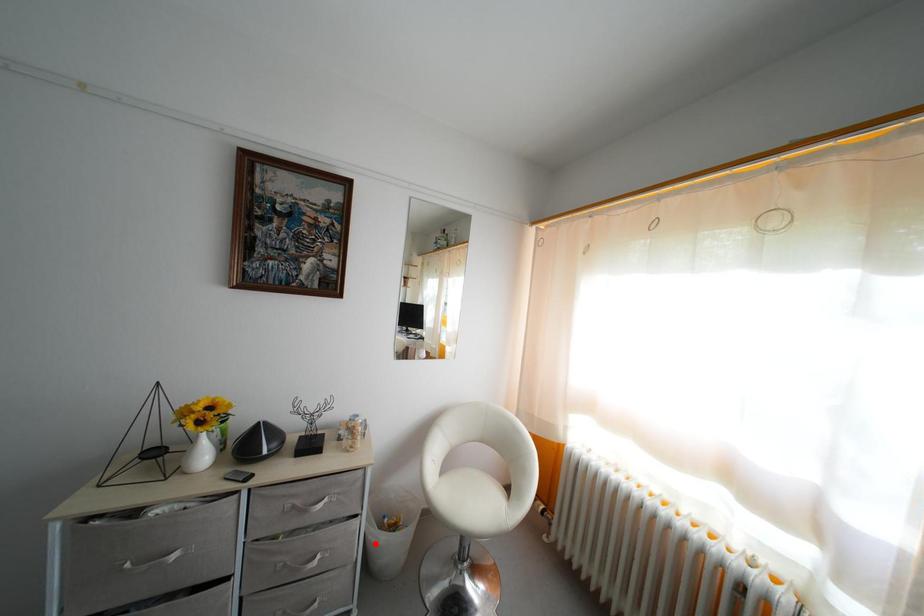
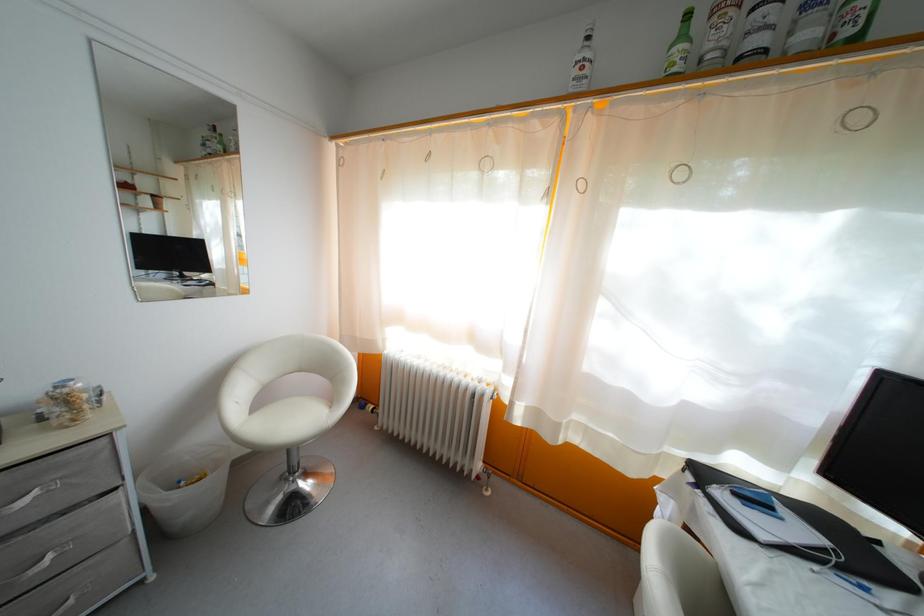
Question: I am providing you with two images of the same scene from different viewpoints. Image1 has a red point marked. In image2, the corresponding 3D location appears at what relative position? Reply with the corresponding letter.

Choices:
 (A) Closer
 (B) Farther

Answer: (B)